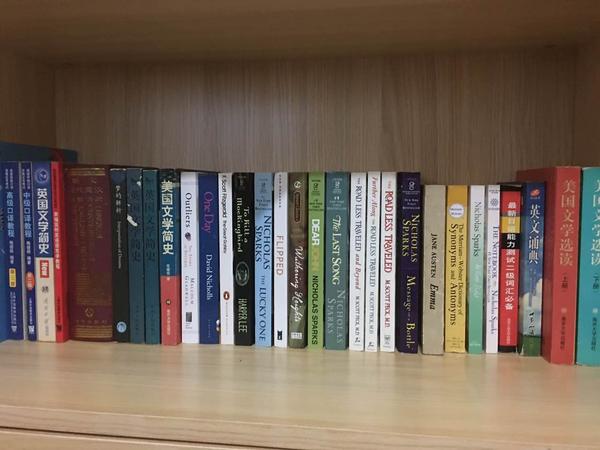
The height and width of the screenshot is (450, 600). In order to click on books with red spines in this screenshot , I will do `click(64, 286)`, `click(86, 291)`, `click(172, 312)`, `click(508, 315)`, `click(561, 318)`.